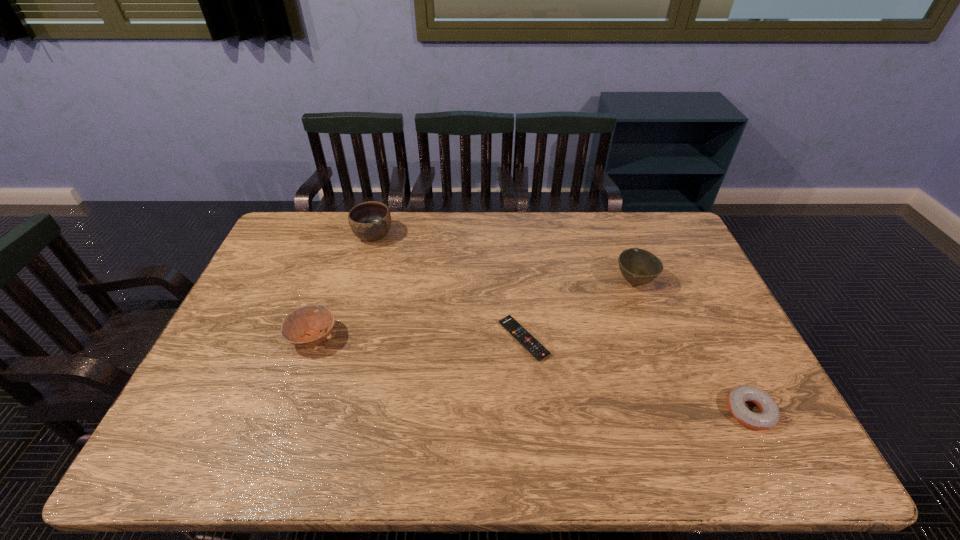
The height and width of the screenshot is (540, 960). I want to click on free space in the image that satisfies the following two spatial constraints: 1. on the back side of the third tallest object; 2. on the left side of the farthest object, so click(x=349, y=235).

What are the coordinates of `vacant space that satisfies the following two spatial constraints: 1. on the front side of the farthest object; 2. on the left side of the nearest object` in the screenshot? It's located at (323, 411).